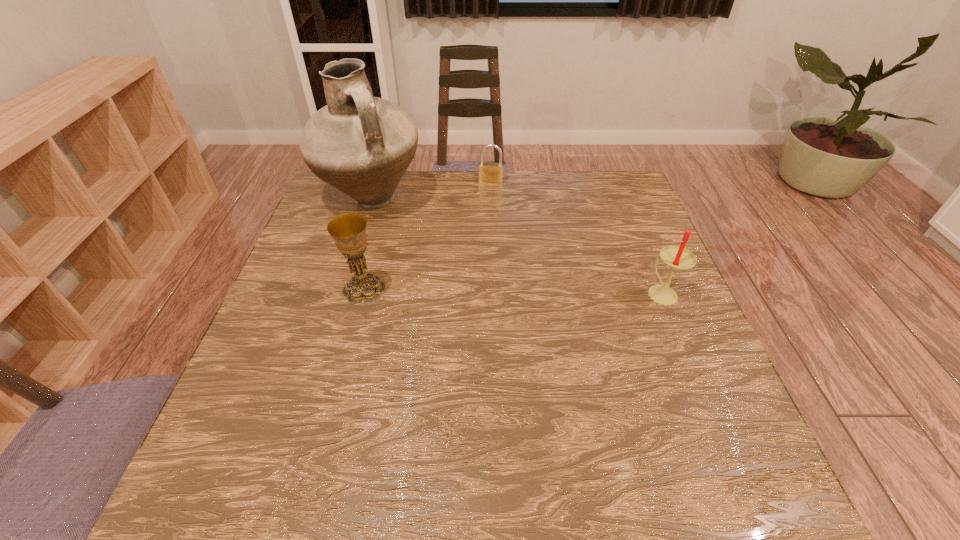
Image resolution: width=960 pixels, height=540 pixels. In the image, there is a desktop. Find the location of `free space at the near edge`. free space at the near edge is located at coordinates (532, 410).

Locate an element on the screen. Image resolution: width=960 pixels, height=540 pixels. vacant region at the left edge is located at coordinates (308, 364).

Image resolution: width=960 pixels, height=540 pixels. In order to click on vacant area at the right edge in this screenshot , I will do `click(611, 276)`.

The image size is (960, 540). What are the coordinates of `vacant space at the far left corner of the desktop` in the screenshot? It's located at (369, 214).

Locate an element on the screen. blank space at the near left corner of the desktop is located at coordinates [270, 410].

Where is `vacant point located between the candle and the shortest object`? vacant point located between the candle and the shortest object is located at coordinates (x=576, y=238).

This screenshot has height=540, width=960. I want to click on free space that is in between the candle and the chalice, so click(x=513, y=291).

Where is `vacant space that's between the pitcher and the candle`? This screenshot has height=540, width=960. vacant space that's between the pitcher and the candle is located at coordinates [516, 247].

This screenshot has width=960, height=540. I want to click on empty space that is in between the chalice and the padlock, so click(x=427, y=236).

Identify the location of unoccupied position between the pitcher and the rightmost object. The width and height of the screenshot is (960, 540). (516, 247).